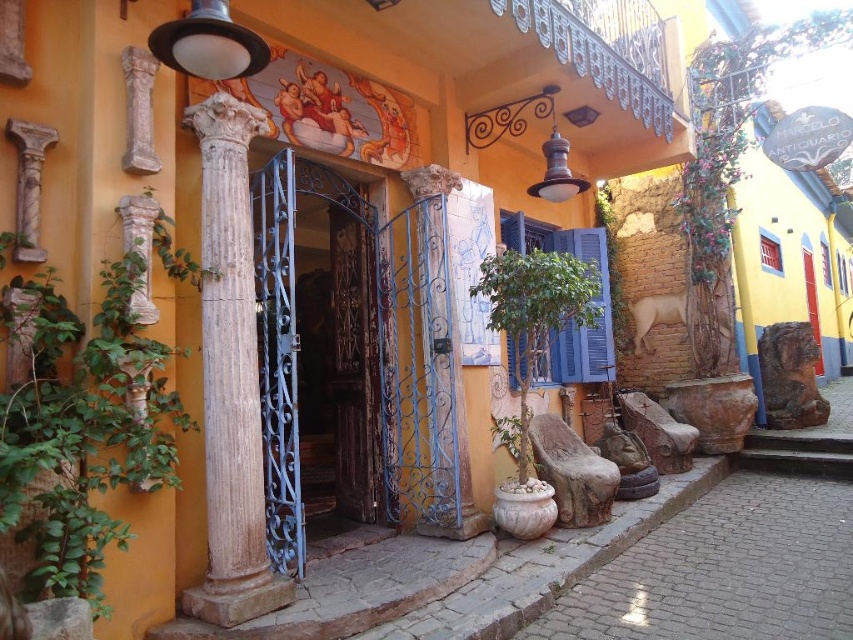
You are standing at the entrance of the building and want to place a small decorative item exactly at the center of the entrance. Given the green leafy plant at right is located at point 0.245, 0.856, can you determine if the plant is positioned to the left or right of the entrance center?

The green leafy plant at right is located at point (729, 156). Since the entrance center would be at 0.5 in the horizontal axis, the plant is positioned to the left of the entrance center.

You are standing at the entrance of the building and looking at the vibrant facade. There is a point marked at coordinates (x=729, y=156). What object is located at this point?

The point at coordinates (x=729, y=156) indicates a green leafy plant at right.

You are standing at the entrance of the building and want to place a decorative item exactly at the center of the entrance area. The entrance area is defined as the space between the two white marble columns flanking the doorway. Given the green leafy plant at right is located at point 0.245, 0.856, would placing the item at the center of the entrance area require moving the plant?

The green leafy plant at right is located at point (729, 156). The entrance area between the two white marble columns flanking the doorway is centered at a different coordinate. Therefore, placing the decorative item at the entrance area center would require moving the plant if it is not already there.